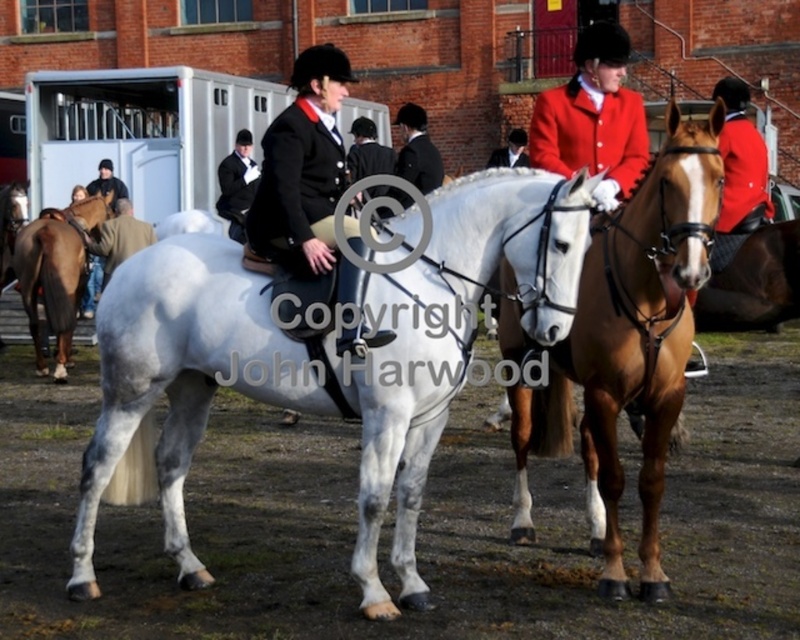
Consider the image. You are a photographer standing in the middle of the field. You want to take a picture of the brown glossy horse at left and the brown leather jacket at left. Can you fit both subjects into your camera frame if your camera has a 30 inch wide field of view?

The brown glossy horse at left and brown leather jacket at left are 25.69 inches apart from each other. Since your camera has a 30 inch wide field of view, which is wider than the distance between them, you can fit both subjects into the frame.

You are a photographer planning to take a group photo of the riders and their horses. You need to ensure that both the brown glossy horse at left and the brown leather jacket at left are clearly visible. Given their size difference, which object should be placed closer to the camera to maintain visual balance?

The brown leather jacket at left is smaller in size than the brown glossy horse at left, so placing the brown leather jacket at left closer to the camera will help balance their visual presence.

You are a photographer setting up a tripod to capture the scene. The tripod requires a minimum height of 1.5 meters to frame the shot properly. Given the red wool coat at center and the brown glossy horse at left, which object is more likely to block the camera view if they are positioned between the camera and the main subject?

The brown glossy horse at left is taller than the red wool coat at center, so it is more likely to block the camera view if positioned between the camera and the main subject.